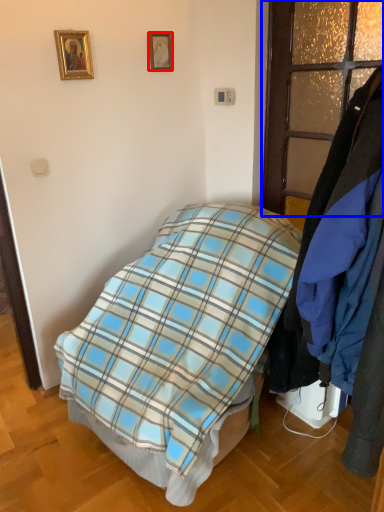
Question: Which object appears closest to the camera in this image, picture frame (highlighted by a red box) or glass door (highlighted by a blue box)?

Choices:
 (A) picture frame
 (B) glass door

Answer: (B)